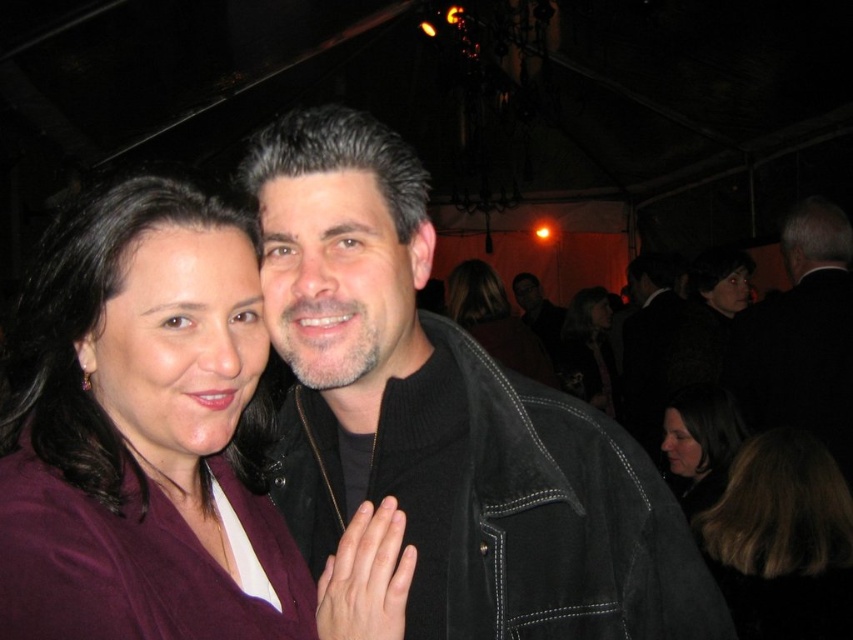
Between purple fabric at center and dark brown hair at lower right, which one is positioned lower?

Positioned lower is dark brown hair at lower right.

Between purple fabric at center and dark brown hair at lower right, which one appears on the left side from the viewer's perspective?

purple fabric at center is more to the left.

What do you see at coordinates (154, 436) in the screenshot? This screenshot has width=853, height=640. I see `purple fabric at center` at bounding box center [154, 436].

Identify the location of purple fabric at center. The image size is (853, 640). (154, 436).

Can you confirm if purple fabric at center is taller than brown fuzzy hair at lower right?

Yes.

Is point (183, 636) positioned behind point (804, 580)?

No, (183, 636) is in front of (804, 580).

Image resolution: width=853 pixels, height=640 pixels. In order to click on purple fabric at center in this screenshot , I will do `click(154, 436)`.

Describe the element at coordinates (494, 321) in the screenshot. I see `smooth black dress at center` at that location.

How much distance is there between smooth black dress at center and dark brown hair at center?

smooth black dress at center is 3.69 feet from dark brown hair at center.

Between point (476, 320) and point (585, 332), which one is positioned behind?

Point (585, 332)

Locate an element on the screen. This screenshot has height=640, width=853. smooth black dress at center is located at coordinates (494, 321).